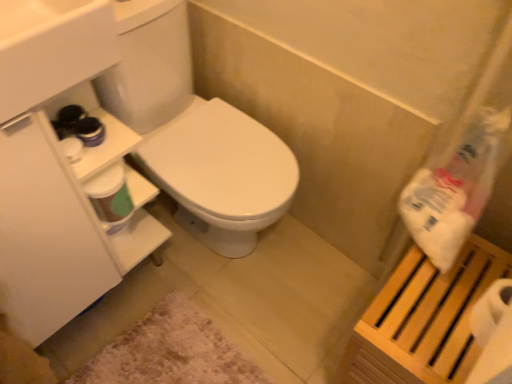
Locate an element on the screen. vacant region above wooden slatted shelf at right (from a real-world perspective) is located at coordinates (455, 291).